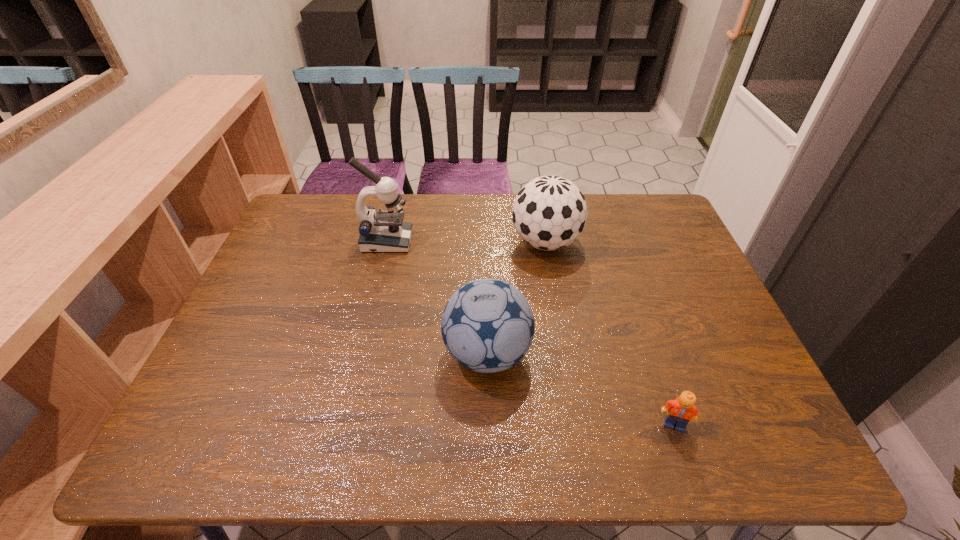
What are the coordinates of `microscope` in the screenshot? It's located at (384, 231).

Where is `the leftmost object`? This screenshot has width=960, height=540. the leftmost object is located at coordinates (384, 231).

Find the location of a particular element. the farther soccer ball is located at coordinates (550, 212).

Where is `the third farthest object`? the third farthest object is located at coordinates (487, 325).

What are the coordinates of `the shortest object` in the screenshot? It's located at (680, 411).

Where is `the rightmost object`? The image size is (960, 540). the rightmost object is located at coordinates (680, 411).

Locate an element on the screen. The width and height of the screenshot is (960, 540). blank space located at the eyepiece of the leftmost object is located at coordinates (489, 241).

This screenshot has width=960, height=540. Identify the location of free space located on the front of the farther soccer ball. (555, 295).

Image resolution: width=960 pixels, height=540 pixels. What are the coordinates of `vacant space positioned on the side with brand of the second nearest object` in the screenshot? It's located at (377, 354).

The height and width of the screenshot is (540, 960). In order to click on free spot located on the side with brand of the second nearest object in this screenshot , I will do `click(361, 354)`.